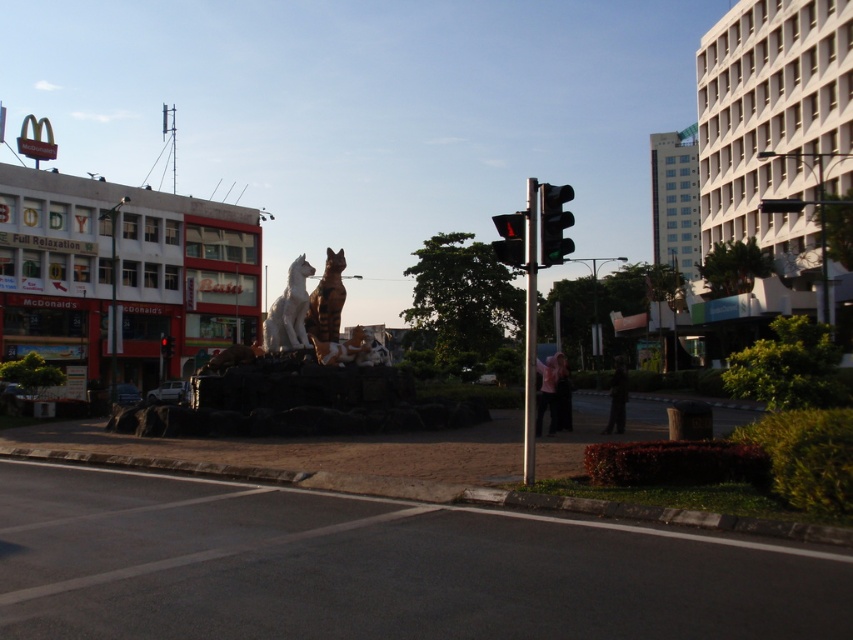
You are a driver approaching the roundabout and see both the green glass traffic light at upper right and the black plastic traffic light at center. Which traffic light is larger in size?

The black plastic traffic light at center is larger than the green glass traffic light at upper right.

You are standing at the roundabout and want to take a photo of the large sculpture with the McDonalds restaurant in the background. If you move 10 meters closer to the point at coordinates point (x=335, y=291), will the McDonalds still be visible in the background?

The point (x=335, y=291) is 20.69 meters away from the viewer. Moving 10 meters closer would bring you to 10.69 meters from the point. Since the McDonalds is part of the background in the original scene, moving closer to the point might still keep the McDonalds visible in the background unless the angle changes significantly. However, without specific information about the field of view or the layout beyond the given data, it is uncertain. The answer cannot be definitively confirmed with the provided details.